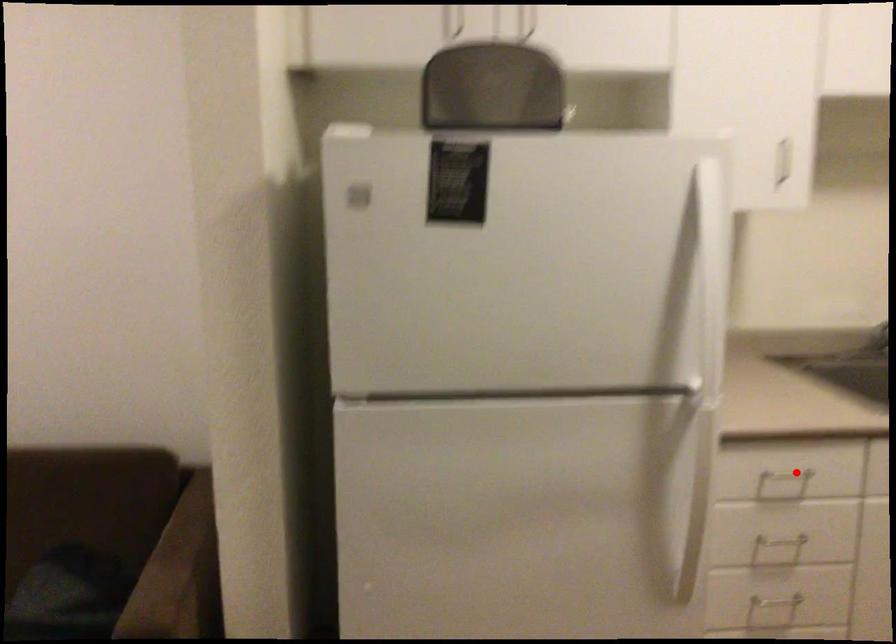
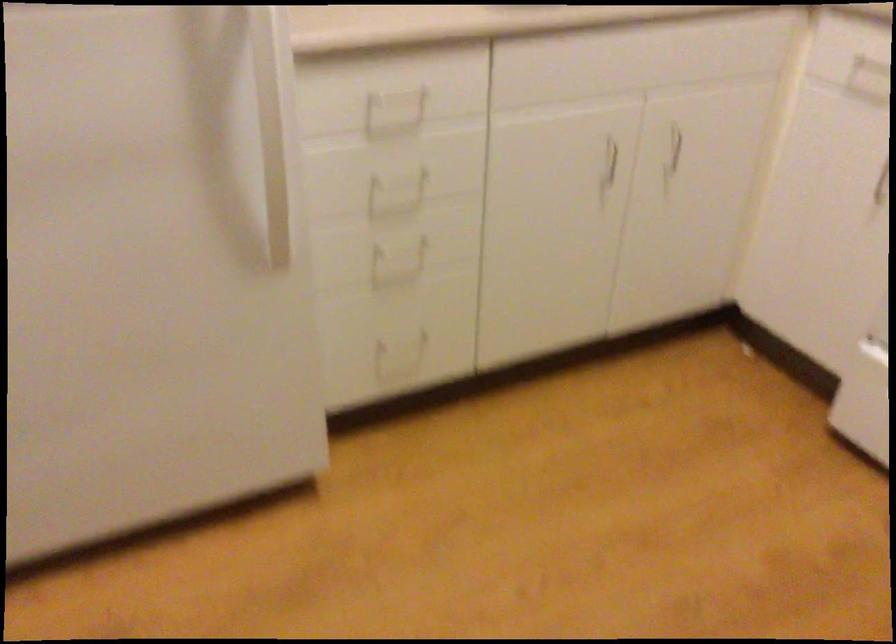
In the second image, find the point that corresponds to the highlighted location in the first image.

(403, 91)